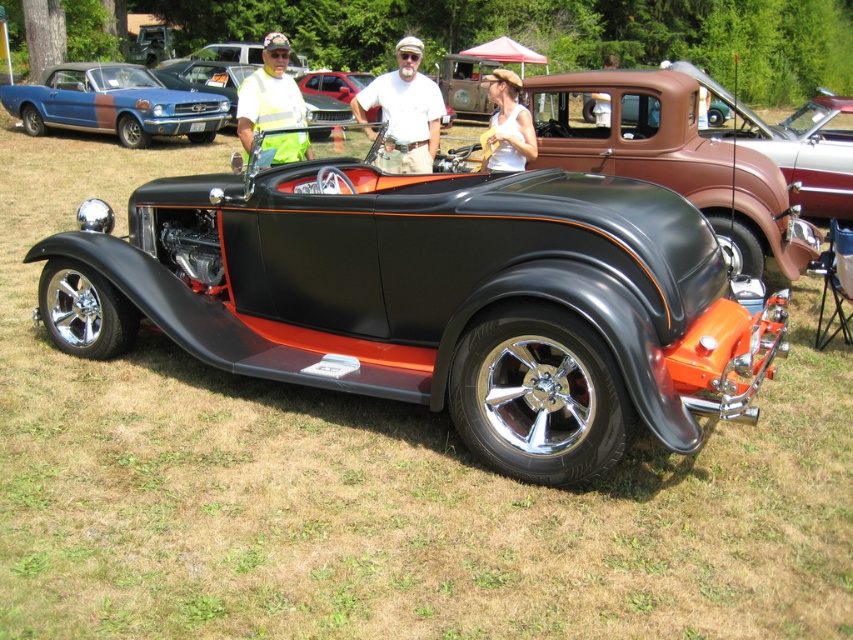
You are a photographer at the car show and want to take a picture of the matte white tank top at center and the matte blue and brown car at upper left. Which one is closer to you?

The matte blue and brown car at upper left is closer to you than the matte white tank top at center, so the matte blue and brown car at upper left would be in front in the photo.

You are at a car show and see the matte blue and brown car at upper left and the matte white tank top at center. Which object is positioned more to the left side of the scene?

The matte blue and brown car at upper left is positioned more to the left side of the scene compared to the matte white tank top at center.

You are a photographer at the car show and want to capture both the matte brown pickup truck at center and the matte white tank top at center in a single shot. Based on their positions, which object is lower in the frame?

The matte brown pickup truck at center is located below the matte white tank top at center, so the pickup truck is lower in the frame.